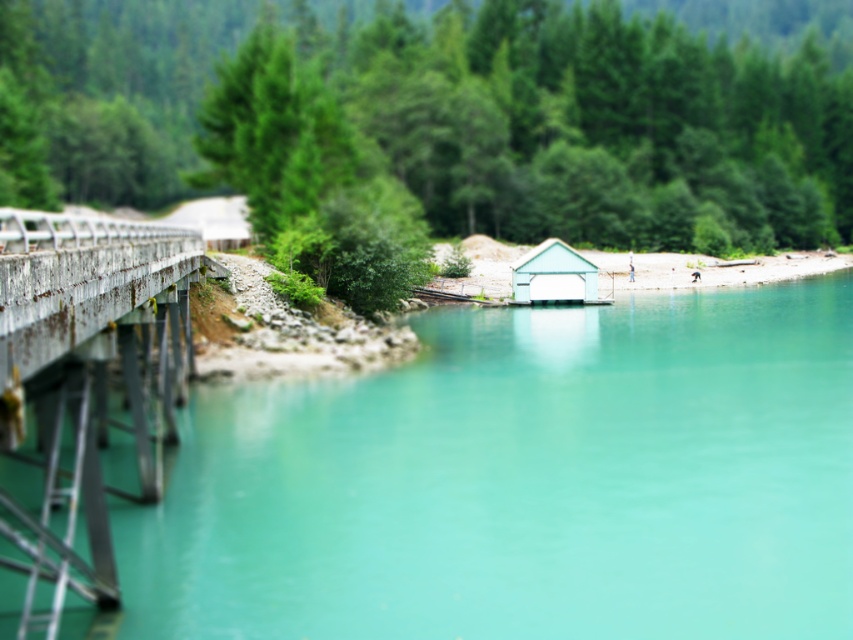
You are planning to build a small boat dock on the lakeside. The boat requires a surface area larger than the light blue matte hut at center. Can the teal glossy water at center accommodate the boat?

The teal glossy water at center is bigger than the light blue matte hut at center, so yes, the teal glossy water at center can accommodate the boat since it has a larger surface area than the light blue matte hut at center.

You are standing on the wooden pier on the left side of the image and want to reach the light blue matte hut at center without getting your feet wet. Can you walk directly across the teal glossy water at center to get there?

The teal glossy water at center is wider than the light blue matte hut at center, so you cannot walk directly across the teal glossy water at center to reach the light blue matte hut at center without getting wet.